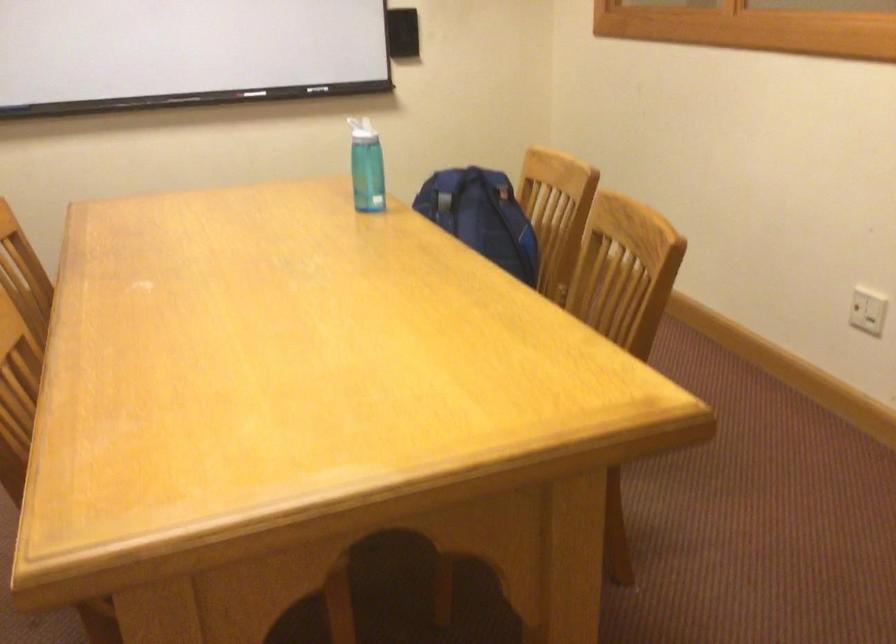
What do you see at coordinates (362, 129) in the screenshot?
I see `the white bottle lid` at bounding box center [362, 129].